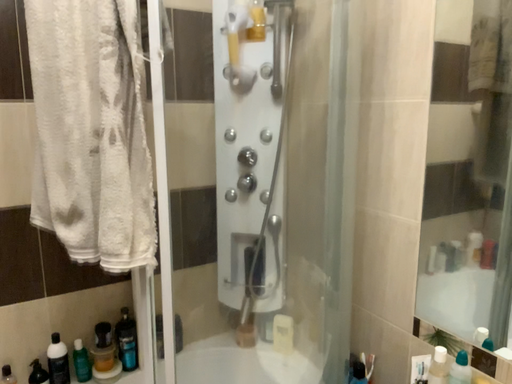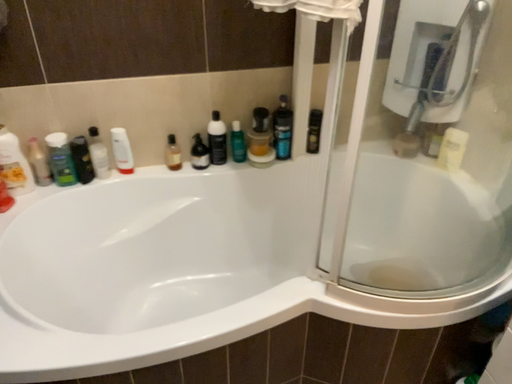
Question: Which way did the camera rotate in the video?

Choices:
 (A) rotated upward
 (B) rotated downward

Answer: (B)